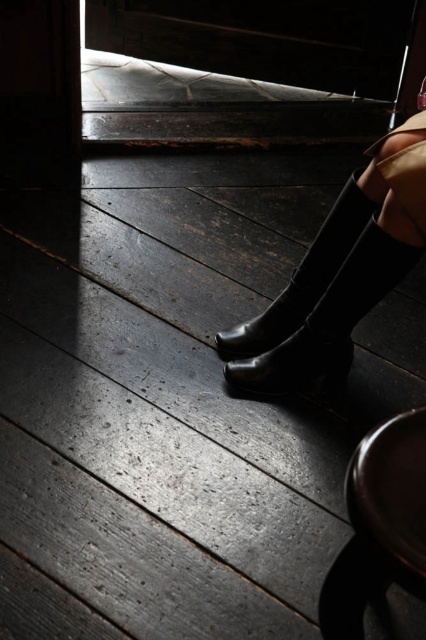
Question: Among these points, which one is nearest to the camera?

Choices:
 (A) (322, 360)
 (B) (359, 225)

Answer: (B)

Question: Among these points, which one is farthest from the camera?

Choices:
 (A) (354, 246)
 (B) (264, 323)
 (C) (399, 220)

Answer: (B)

Question: Can you confirm if black leather boots at lower right is positioned to the right of shiny black boot at center?

Choices:
 (A) yes
 (B) no

Answer: (A)

Question: Which of the following is the farthest from the observer?

Choices:
 (A) (261, 380)
 (B) (345, 342)
 (C) (299, 321)

Answer: (C)

Question: Can you confirm if black leather boots at lower right is positioned to the left of rubber matte boot at center?

Choices:
 (A) no
 (B) yes

Answer: (A)

Question: Is the position of shiny black boot at center less distant than that of rubber matte boot at center?

Choices:
 (A) no
 (B) yes

Answer: (B)